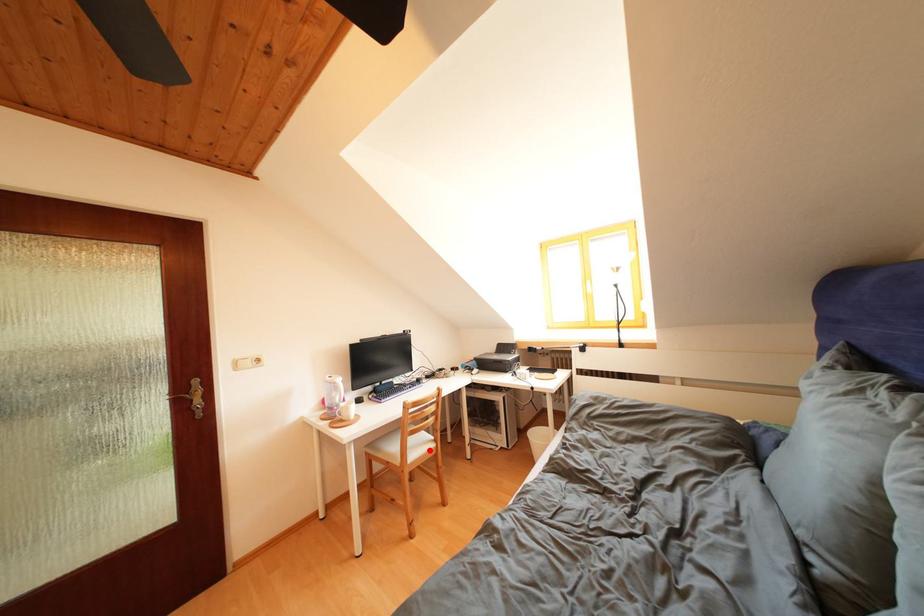
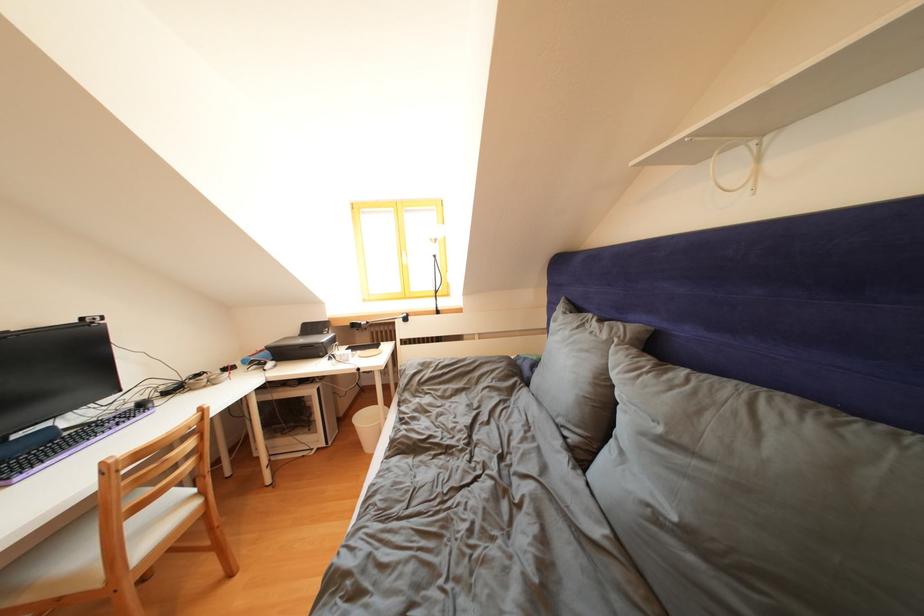
Find the pixel in the second image that matches the highlighted location in the first image.

(175, 522)